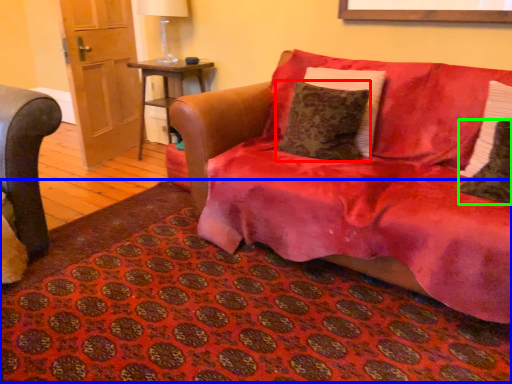
Question: Which object is positioned farthest from pillow (highlighted by a red box)? Select from mat (highlighted by a blue box) and pillow (highlighted by a green box).

Choices:
 (A) mat
 (B) pillow

Answer: (A)